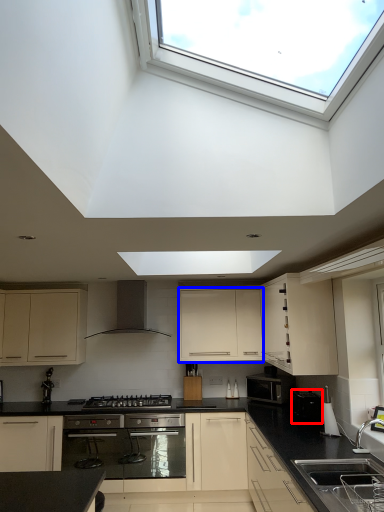
Question: Which object is closer to the camera taking this photo, appliance (highlighted by a red box) or cabinetry (highlighted by a blue box)?

Choices:
 (A) appliance
 (B) cabinetry

Answer: (A)